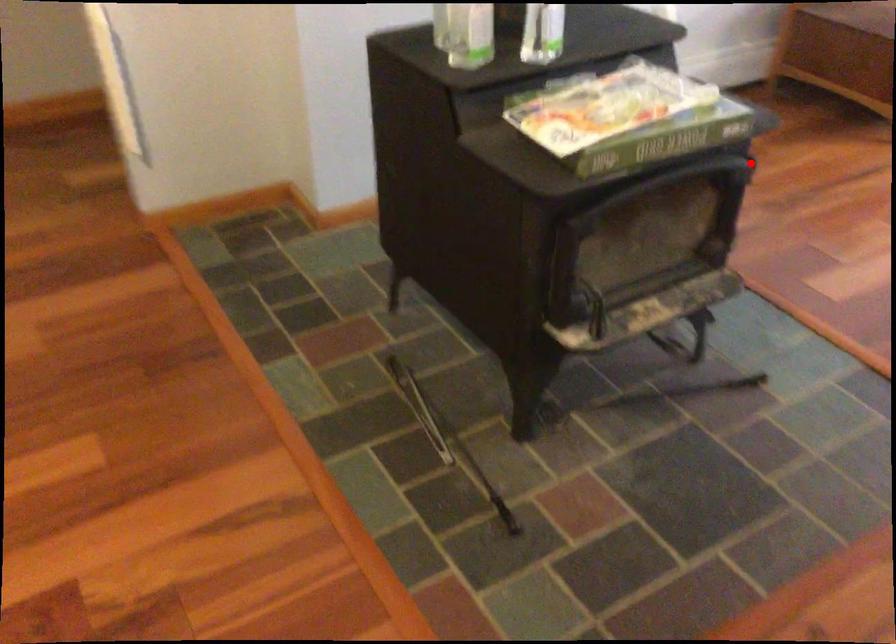
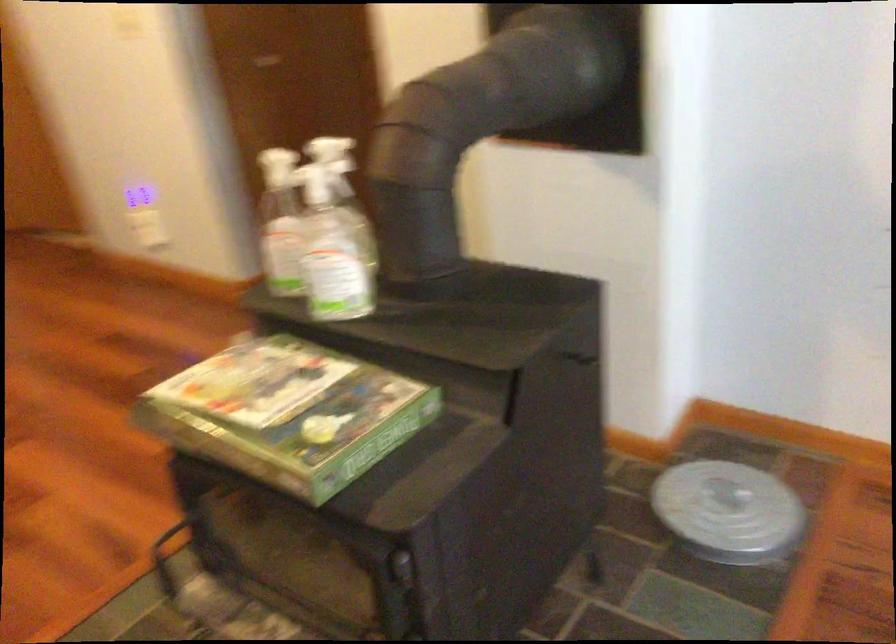
The point at the highlighted location is marked in the first image. Where is the corresponding point in the second image?

(401, 567)